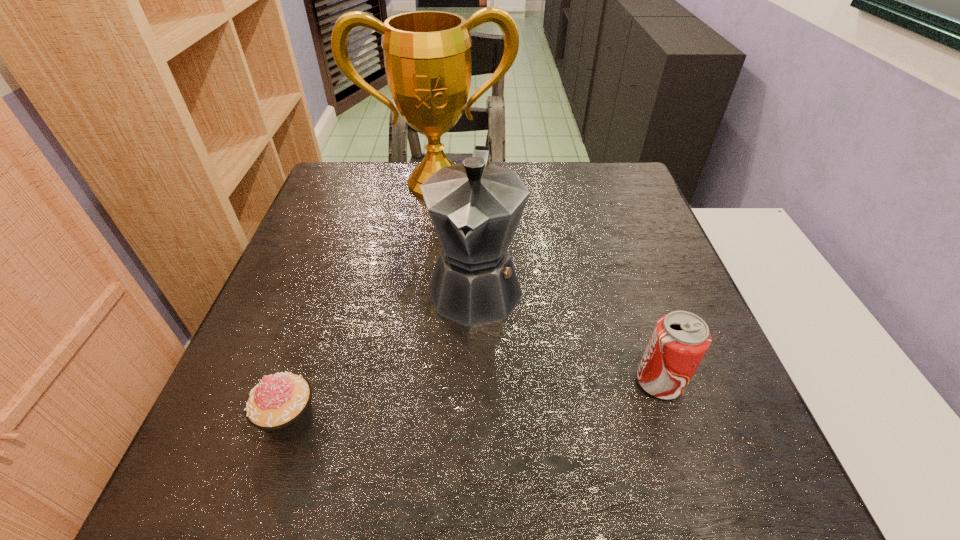
Locate an element on the screen. Image resolution: width=960 pixels, height=540 pixels. the shortest object is located at coordinates (280, 405).

Find the location of a particular element. The image size is (960, 540). the rightmost object is located at coordinates (680, 339).

Image resolution: width=960 pixels, height=540 pixels. What are the coordinates of `the second shortest object` in the screenshot? It's located at (680, 339).

Where is `award`? This screenshot has height=540, width=960. award is located at coordinates (427, 56).

The width and height of the screenshot is (960, 540). What are the coordinates of `the farthest object` in the screenshot? It's located at (427, 56).

Where is `the second farthest object`? Image resolution: width=960 pixels, height=540 pixels. the second farthest object is located at coordinates (475, 207).

Locate an element on the screen. This screenshot has width=960, height=540. the third shortest object is located at coordinates coord(475,207).

You are a GUI agent. You are given a task and a screenshot of the screen. Output one action in this format:
    pyautogui.click(x=<x>, y=<y>)
    Task: Click on the vacant space located on the right of the shortest object
    The height and width of the screenshot is (540, 960).
    Given the screenshot: What is the action you would take?
    pyautogui.click(x=529, y=421)

Image resolution: width=960 pixels, height=540 pixels. Find the location of `vacant area situated on the left of the rightmost object`. vacant area situated on the left of the rightmost object is located at coordinates (465, 382).

I want to click on vacant space located on the front-facing side of the farthest object, so click(x=447, y=226).